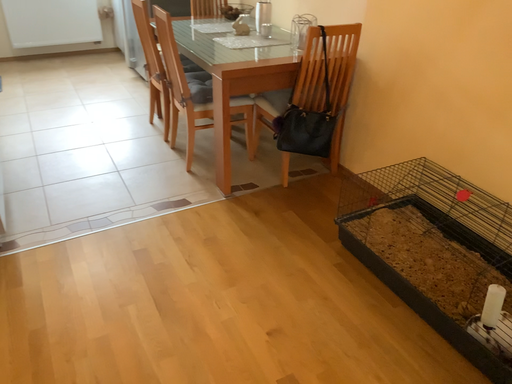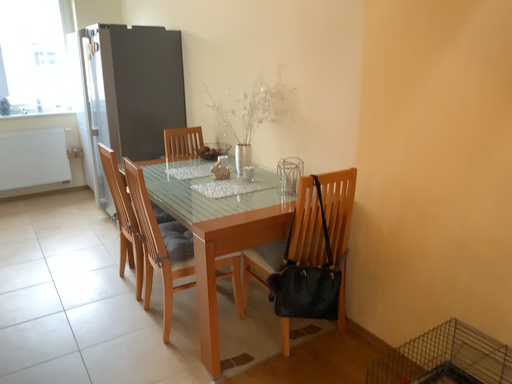
Question: Which way did the camera rotate in the video?

Choices:
 (A) rotated downward
 (B) rotated upward

Answer: (B)